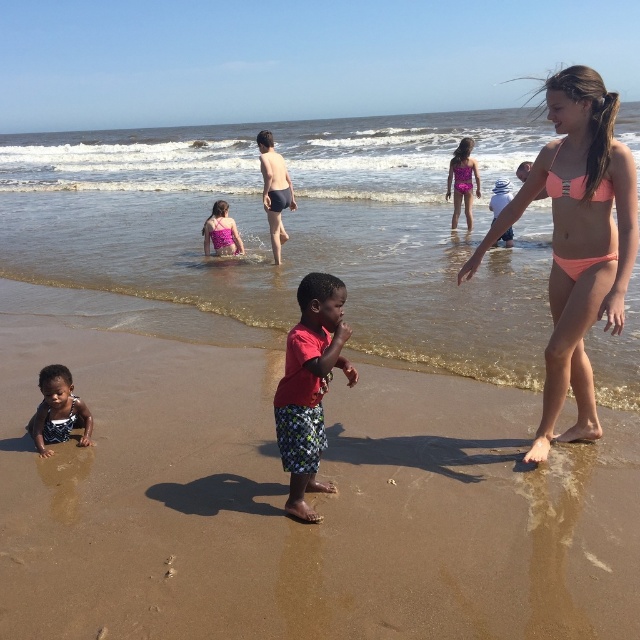
You are a photographer standing at the shoreline. You want to take a photo that includes both the pink matte bikini at right and the pink fabric swimsuit at center. Given that your camera has a maximum zoom range of 10 meters, will you be able to capture both subjects in the same frame?

The pink matte bikini at right is 7.85 meters away from the pink fabric swimsuit at center. Since the distance between them is within the camera maximum zoom range of 10 meters, you can capture both subjects in the same frame.

You are a photographer standing at the beach and want to take a photo that includes both the white dotted swimsuit at lower left and the pink fabric bikini at center. Which one should you focus on first to ensure both are in clear view?

The white dotted swimsuit at lower left is closer to the viewer than the pink fabric bikini at center, so you should focus on the white dotted swimsuit at lower left first to ensure both are in clear view.

You are a photographer trying to capture a shot of the white dotted swimsuit at lower left and the pink fabric bikini at center. Which swimwear has a wider width for the photo frame?

The white dotted swimsuit at lower left has a larger width than the pink fabric bikini at center, so it will fit better in the photo frame.